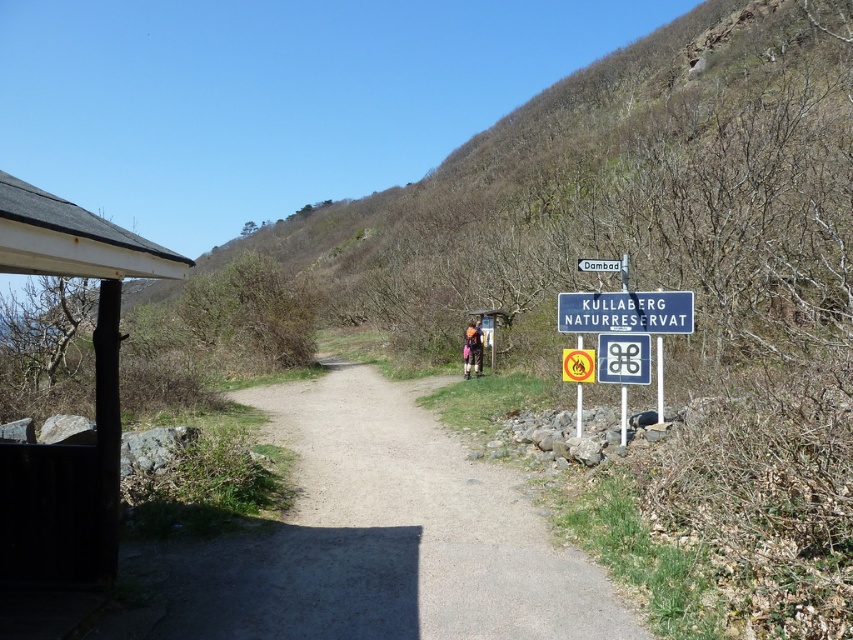
Can you confirm if dirt path at center is positioned to the right of white plastic sign at upper center?

Incorrect, dirt path at center is not on the right side of white plastic sign at upper center.

How far apart are dirt path at center and white plastic sign at upper center?

dirt path at center and white plastic sign at upper center are 4.27 meters apart from each other.

This screenshot has width=853, height=640. What are the coordinates of `dirt path at center` in the screenshot? It's located at (376, 538).

Where is `dirt path at center`? The width and height of the screenshot is (853, 640). dirt path at center is located at coordinates (376, 538).

Can you confirm if dirt path at center is smaller than brown fabric backpack at center?

Incorrect, dirt path at center is not smaller in size than brown fabric backpack at center.

Describe the element at coordinates (376, 538) in the screenshot. I see `dirt path at center` at that location.

Measure the distance between point (x=569, y=634) and camera.

Point (x=569, y=634) and camera are 4.54 meters apart from each other.

Identify the location of dirt path at center. (376, 538).

Does brown fabric backpack at center have a greater width compared to brown leather backpack at center?

Indeed, brown fabric backpack at center has a greater width compared to brown leather backpack at center.

Who is more distant from viewer, (473, 342) or (466, 355)?

Point (473, 342)

The height and width of the screenshot is (640, 853). I want to click on brown fabric backpack at center, so click(x=473, y=349).